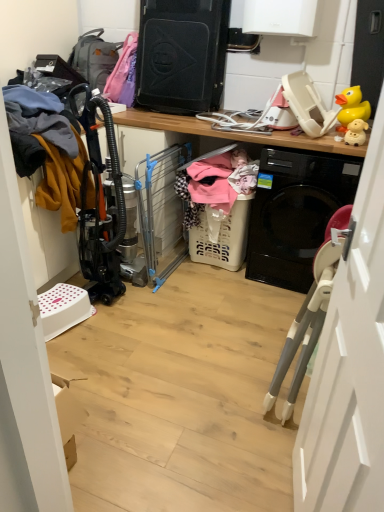
Identify the location of vacant space in front of white plastic laundry basket at center. Image resolution: width=384 pixels, height=512 pixels. (228, 291).